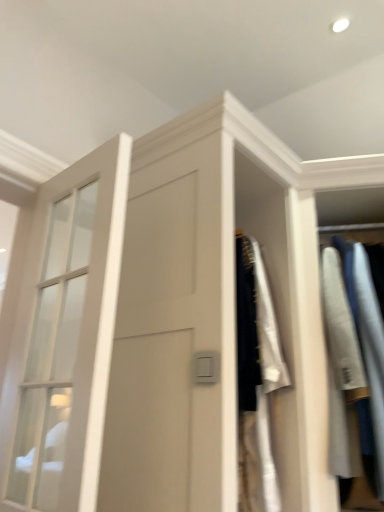
Question: Does clear glass door at left have a lesser height compared to light gray cotton shirt at right?

Choices:
 (A) yes
 (B) no

Answer: (A)

Question: Can you confirm if clear glass door at left is taller than light gray cotton shirt at right?

Choices:
 (A) yes
 (B) no

Answer: (B)

Question: Can you confirm if clear glass door at left is thinner than light gray cotton shirt at right?

Choices:
 (A) yes
 (B) no

Answer: (A)

Question: From the image's perspective, is clear glass door at left above light gray cotton shirt at right?

Choices:
 (A) yes
 (B) no

Answer: (A)

Question: Is clear glass door at left not inside light gray cotton shirt at right?

Choices:
 (A) no
 (B) yes

Answer: (B)

Question: Are clear glass door at left and light gray cotton shirt at right located far from each other?

Choices:
 (A) yes
 (B) no

Answer: (A)

Question: Does light gray cotton shirt at right have a lesser height compared to clear glass door at left?

Choices:
 (A) yes
 (B) no

Answer: (B)

Question: From a real-world perspective, is light gray cotton shirt at right located beneath clear glass door at left?

Choices:
 (A) yes
 (B) no

Answer: (B)

Question: From the image's perspective, is light gray cotton shirt at right below clear glass door at left?

Choices:
 (A) yes
 (B) no

Answer: (A)

Question: Is light gray cotton shirt at right smaller than clear glass door at left?

Choices:
 (A) no
 (B) yes

Answer: (A)

Question: Does light gray cotton shirt at right lie behind clear glass door at left?

Choices:
 (A) no
 (B) yes

Answer: (B)

Question: Considering the relative positions of light gray cotton shirt at right and clear glass door at left in the image provided, is light gray cotton shirt at right to the right of clear glass door at left from the viewer's perspective?

Choices:
 (A) no
 (B) yes

Answer: (B)

Question: Considering the relative positions of clear glass door at left and light gray cotton shirt at right in the image provided, is clear glass door at left to the left or to the right of light gray cotton shirt at right?

Choices:
 (A) right
 (B) left

Answer: (B)